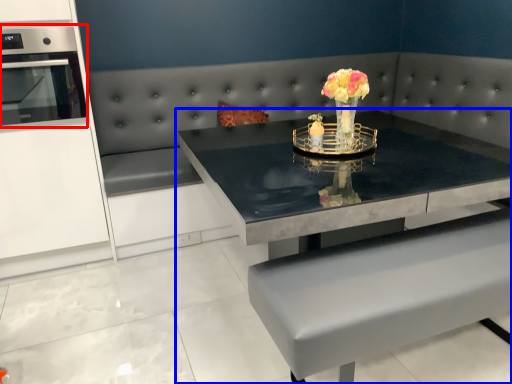
Question: Which point is closer to the camera, appliance (highlighted by a red box) or table (highlighted by a blue box)?

Choices:
 (A) appliance
 (B) table

Answer: (B)